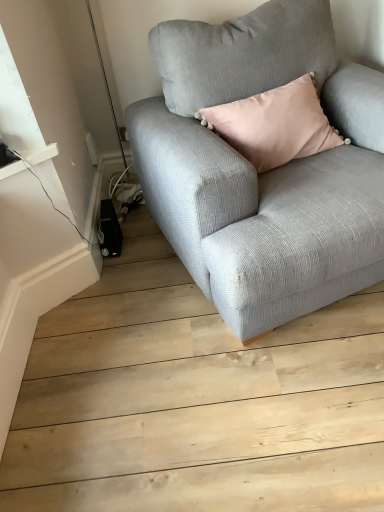
Find the location of a particular element. textured gray couch at center is located at coordinates (267, 172).

Describe the element at coordinates (267, 172) in the screenshot. I see `textured gray couch at center` at that location.

I want to click on textured gray couch at center, so click(x=267, y=172).